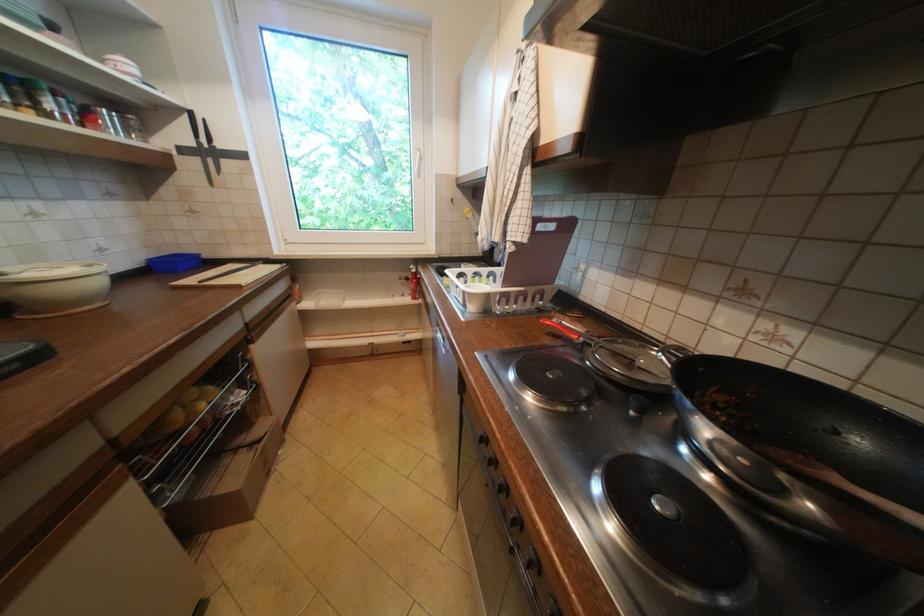
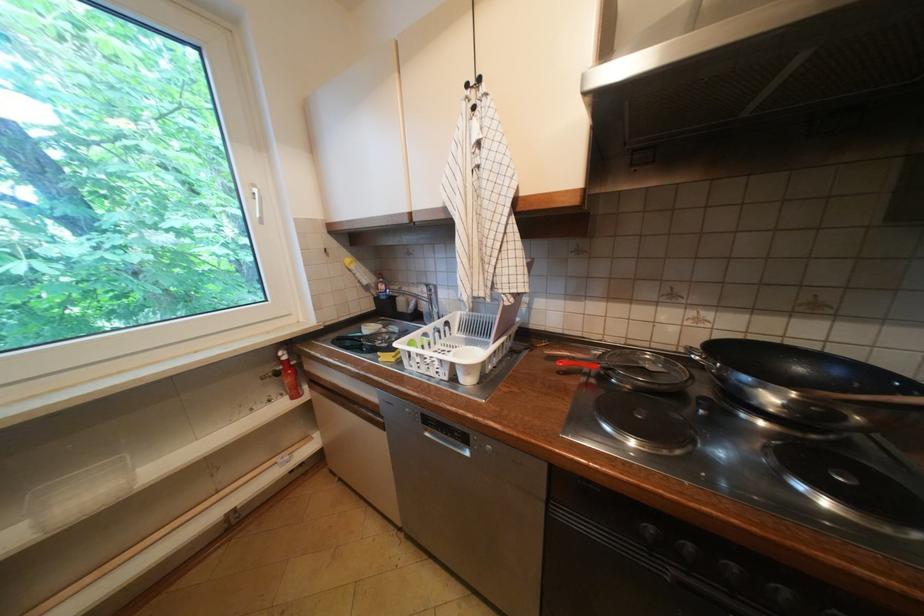
Question: The camera is either moving clockwise (left) or counter-clockwise (right) around the object. The first image is from the beginning of the video and the second image is from the end. Is the camera moving left or right when shooting the video?

Choices:
 (A) Left
 (B) Right

Answer: (A)